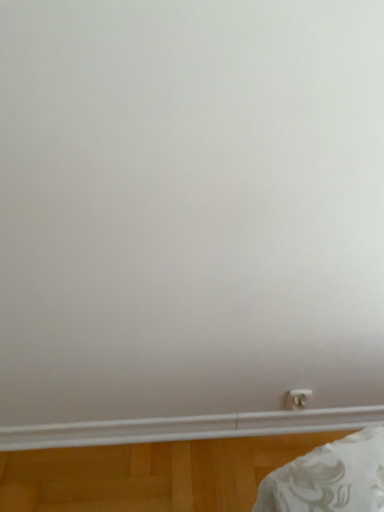
The height and width of the screenshot is (512, 384). Describe the element at coordinates (297, 398) in the screenshot. I see `white plastic electric outlet at lower right` at that location.

In order to face white plastic electric outlet at lower right, should I rotate leftwards or rightwards?

You should rotate right by 14.153 degrees.

The width and height of the screenshot is (384, 512). Identify the location of white plastic electric outlet at lower right. (297, 398).

Identify the location of white plastic electric outlet at lower right. This screenshot has width=384, height=512. (297, 398).